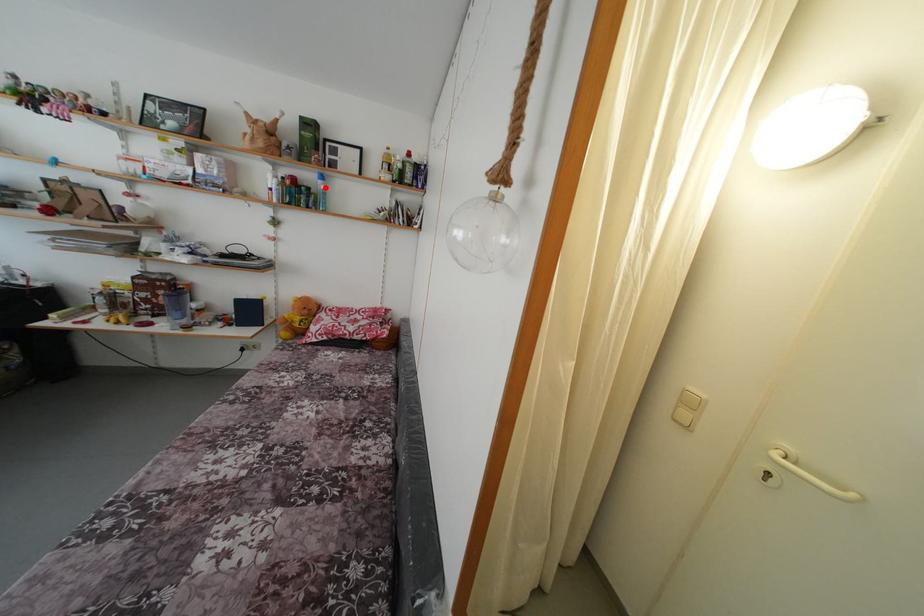
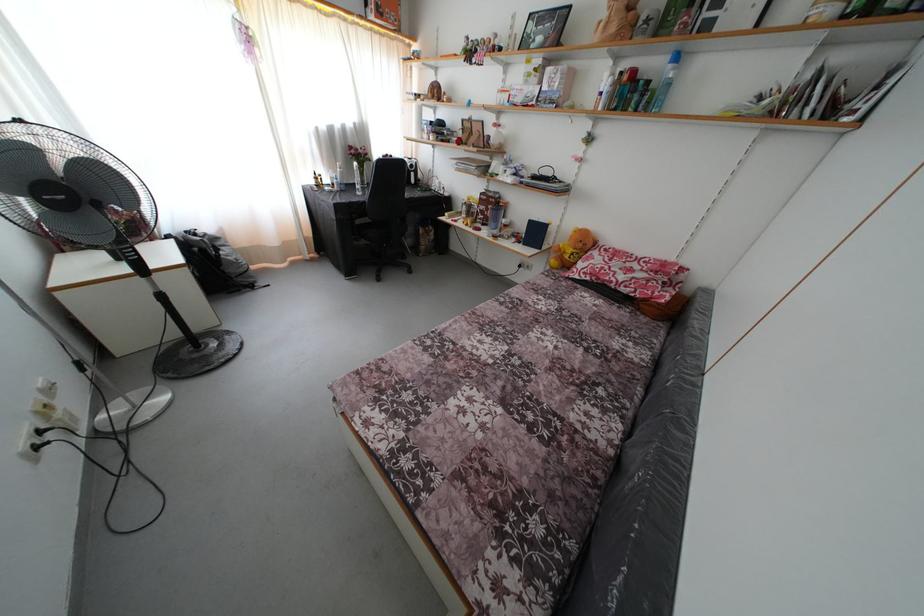
Question: I am providing you with two images of the same scene from different viewpoints. Image1 has a red point marked. In image2, the corresponding 3D location appears at what relative position? Reply with the corresponding letter.

Choices:
 (A) Closer
 (B) Farther

Answer: (B)